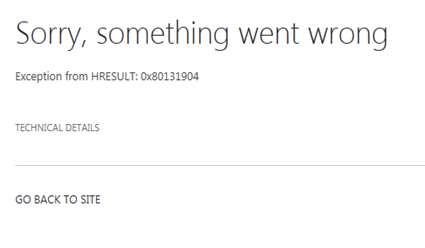
In order to click on minimalist design in this screenshot , I will do `click(268, 83)`.